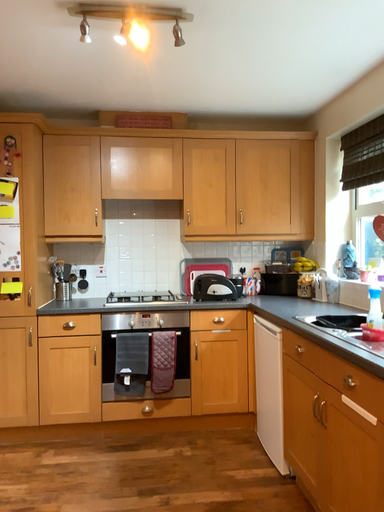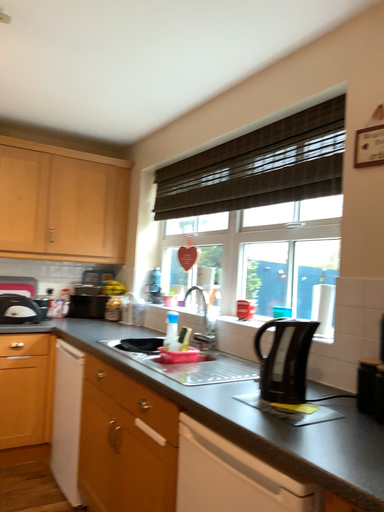
Question: Which way did the camera rotate in the video?

Choices:
 (A) rotated left
 (B) rotated right

Answer: (B)